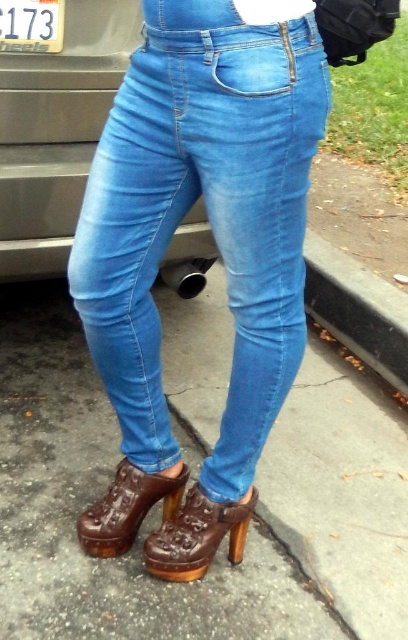
Question: Is denim jeans at center wider than white plastic license plate at upper left?

Choices:
 (A) no
 (B) yes

Answer: (B)

Question: Which of the following is the closest to the observer?

Choices:
 (A) brown leather boot at lower center
 (B) brown leather sandal at lower center
 (C) denim jeans at center
 (D) white plastic license plate at upper left

Answer: (C)

Question: Does brown leather sandal at lower center appear under white plastic license plate at upper left?

Choices:
 (A) yes
 (B) no

Answer: (A)

Question: Which point is farther to the camera?

Choices:
 (A) brown leather boot at lower center
 (B) white plastic license plate at upper left
 (C) denim jeans at center

Answer: (B)

Question: Can you confirm if brown leather sandal at lower center is positioned to the right of brown leather boot at lower center?

Choices:
 (A) no
 (B) yes

Answer: (B)

Question: Among these objects, which one is nearest to the camera?

Choices:
 (A) denim jeans at center
 (B) white plastic license plate at upper left
 (C) brown leather sandal at lower center

Answer: (A)